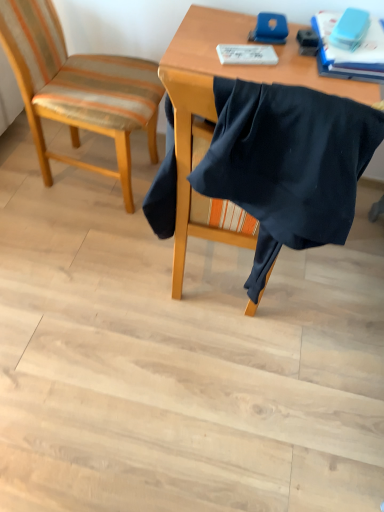
The width and height of the screenshot is (384, 512). I want to click on blue matte book at upper right, so click(x=350, y=51).

Looking at this image, in order to face black fabric at center, acting as the 2th chair starting from the left, should I rotate leftwards or rightwards?

Turn right approximately 6.340 degrees to face it.

Locate an element on the screen. black fabric at center, acting as the 2th chair starting from the left is located at coordinates (287, 165).

Find the location of a particular element. white paper at upper center is located at coordinates (246, 54).

Is white paper at upper center positioned behind striped fabric chair at left, marked as the first chair in a left-to-right arrangement?

Yes, white paper at upper center is further from the camera.

What's the angular difference between white paper at upper center and striped fabric chair at left, placed as the 2th chair when sorted from right to left,'s facing directions?

The facing directions of white paper at upper center and striped fabric chair at left, placed as the 2th chair when sorted from right to left, are 20.1 degrees apart.

From the image's perspective, is white paper at upper center over striped fabric chair at left, marked as the first chair in a left-to-right arrangement?

Indeed, from the image's perspective, white paper at upper center is shown above striped fabric chair at left, marked as the first chair in a left-to-right arrangement.

Does white paper at upper center appear on the right side of striped fabric chair at left, placed as the 2th chair when sorted from right to left?

Correct, you'll find white paper at upper center to the right of striped fabric chair at left, placed as the 2th chair when sorted from right to left.

From the image's perspective, between blue matte book at upper right and striped fabric chair at left, marked as the first chair in a left-to-right arrangement, which one is located above?

blue matte book at upper right.

From the picture: Is blue matte book at upper right inside or outside of striped fabric chair at left, placed as the 2th chair when sorted from right to left?

blue matte book at upper right exists outside the volume of striped fabric chair at left, placed as the 2th chair when sorted from right to left.

Is blue matte book at upper right looking in the opposite direction of striped fabric chair at left, marked as the first chair in a left-to-right arrangement?

No, blue matte book at upper right is not facing away from striped fabric chair at left, marked as the first chair in a left-to-right arrangement.

Based on their positions, is blue matte book at upper right located to the left or right of striped fabric chair at left, marked as the first chair in a left-to-right arrangement?

From the image, it's evident that blue matte book at upper right is to the right of striped fabric chair at left, marked as the first chair in a left-to-right arrangement.

Is striped fabric chair at left, placed as the 2th chair when sorted from right to left, oriented towards black fabric at center, the first chair in the right-to-left sequence?

No, striped fabric chair at left, placed as the 2th chair when sorted from right to left, is not aimed at black fabric at center, the first chair in the right-to-left sequence.

Looking at the image, does striped fabric chair at left, marked as the first chair in a left-to-right arrangement, seem bigger or smaller compared to black fabric at center, acting as the 2th chair starting from the left?

Considering their sizes, striped fabric chair at left, marked as the first chair in a left-to-right arrangement, takes up more space than black fabric at center, acting as the 2th chair starting from the left.

Consider the image. Is striped fabric chair at left, placed as the 2th chair when sorted from right to left, wider or thinner than black fabric at center, acting as the 2th chair starting from the left?

In the image, striped fabric chair at left, placed as the 2th chair when sorted from right to left, appears to be wider than black fabric at center, acting as the 2th chair starting from the left.

Is white paper at upper center at the right side of blue matte book at upper right?

No, white paper at upper center is not to the right of blue matte book at upper right.

Considering the positions of point (248, 54) and point (316, 20), is point (248, 54) closer or farther from the camera than point (316, 20)?

Point (248, 54).

Is white paper at upper center not close to blue matte book at upper right?

No, white paper at upper center is in close proximity to blue matte book at upper right.

This screenshot has width=384, height=512. I want to click on book that appears above the white paper at upper center (from the image's perspective), so click(x=350, y=51).

Which of these two, black fabric at center, acting as the 2th chair starting from the left, or blue matte book at upper right, is smaller?

blue matte book at upper right.

From a real-world perspective, which object rests below the other?

In real-world perspective, black fabric at center, the first chair in the right-to-left sequence, is lower.

Is black fabric at center, the first chair in the right-to-left sequence, positioned with its back to blue matte book at upper right?

No, black fabric at center, the first chair in the right-to-left sequence, is not facing away from blue matte book at upper right.

From the image's perspective, is black fabric at center, acting as the 2th chair starting from the left, positioned above or below blue matte book at upper right?

Clearly, from the image's perspective, black fabric at center, acting as the 2th chair starting from the left, is below blue matte book at upper right.

From a real-world perspective, which is physically above, blue matte book at upper right or black fabric at center, the first chair in the right-to-left sequence?

blue matte book at upper right, from a real-world perspective.

Looking at this image, is blue matte book at upper right aimed at black fabric at center, acting as the 2th chair starting from the left?

Yes, blue matte book at upper right is oriented towards black fabric at center, acting as the 2th chair starting from the left.

Considering the points (378, 44) and (253, 123), which point is in front, point (378, 44) or point (253, 123)?

The point (253, 123) is closer.

In the scene shown: Is black fabric at center, the first chair in the right-to-left sequence, inside or outside of striped fabric chair at left, marked as the first chair in a left-to-right arrangement?

black fabric at center, the first chair in the right-to-left sequence, is spatially situated outside striped fabric chair at left, marked as the first chair in a left-to-right arrangement.

From the image's perspective, is black fabric at center, the first chair in the right-to-left sequence, under striped fabric chair at left, marked as the first chair in a left-to-right arrangement?

Yes, from the image's perspective, black fabric at center, the first chair in the right-to-left sequence, is below striped fabric chair at left, marked as the first chair in a left-to-right arrangement.

From a real-world perspective, is black fabric at center, the first chair in the right-to-left sequence, above or below striped fabric chair at left, placed as the 2th chair when sorted from right to left?

In terms of real-world spatial position, black fabric at center, the first chair in the right-to-left sequence, is above striped fabric chair at left, placed as the 2th chair when sorted from right to left.

Image resolution: width=384 pixels, height=512 pixels. What are the coordinates of `chair above the striped fabric chair at left, placed as the 2th chair when sorted from right to left (from a real-world perspective)` in the screenshot? It's located at (287, 165).

From the image's perspective, starting from the white paper at upper center, which chair is the 1st one below? Please provide its 2D coordinates.

[(78, 88)]

Locate an element on the screen. The height and width of the screenshot is (512, 384). book that is above the striped fabric chair at left, marked as the first chair in a left-to-right arrangement (from the image's perspective) is located at coordinates (350, 51).

Looking at the image, which one is located closer to black fabric at center, acting as the 2th chair starting from the left, blue matte book at upper right or white paper at upper center?

white paper at upper center is positioned closer to the anchor black fabric at center, acting as the 2th chair starting from the left.

Based on their spatial positions, is striped fabric chair at left, marked as the first chair in a left-to-right arrangement, or white paper at upper center closer to blue matte book at upper right?

The object closer to blue matte book at upper right is white paper at upper center.

Looking at the image, which one is located further to black fabric at center, the first chair in the right-to-left sequence, white paper at upper center or blue matte book at upper right?

blue matte book at upper right.

Considering their positions, is striped fabric chair at left, placed as the 2th chair when sorted from right to left, positioned further to white paper at upper center than black fabric at center, acting as the 2th chair starting from the left?

black fabric at center, acting as the 2th chair starting from the left.

Looking at this image, when comparing their distances from striped fabric chair at left, marked as the first chair in a left-to-right arrangement, does white paper at upper center or blue matte book at upper right seem closer?

white paper at upper center is closer to striped fabric chair at left, marked as the first chair in a left-to-right arrangement.

Looking at the image, which one is located closer to striped fabric chair at left, placed as the 2th chair when sorted from right to left, white paper at upper center or black fabric at center, acting as the 2th chair starting from the left?

white paper at upper center is closer to striped fabric chair at left, placed as the 2th chair when sorted from right to left.

Estimate the real-world distances between objects in this image. Which object is closer to white paper at upper center, black fabric at center, acting as the 2th chair starting from the left, or blue matte book at upper right?

blue matte book at upper right is closer to white paper at upper center.

From the image, which object appears to be nearer to white paper at upper center, blue matte book at upper right or striped fabric chair at left, placed as the 2th chair when sorted from right to left?

blue matte book at upper right lies closer to white paper at upper center than the other object.

Identify the location of notebook situated between striped fabric chair at left, placed as the 2th chair when sorted from right to left, and blue matte book at upper right from left to right. (246, 54).

Locate an element on the screen. This screenshot has height=512, width=384. book between black fabric at center, the first chair in the right-to-left sequence, and white paper at upper center in the front-back direction is located at coordinates (350, 51).

I want to click on chair between striped fabric chair at left, marked as the first chair in a left-to-right arrangement, and blue matte book at upper right from left to right, so click(287, 165).

What are the coordinates of `chair situated between striped fabric chair at left, marked as the first chair in a left-to-right arrangement, and white paper at upper center from left to right` in the screenshot? It's located at (287, 165).